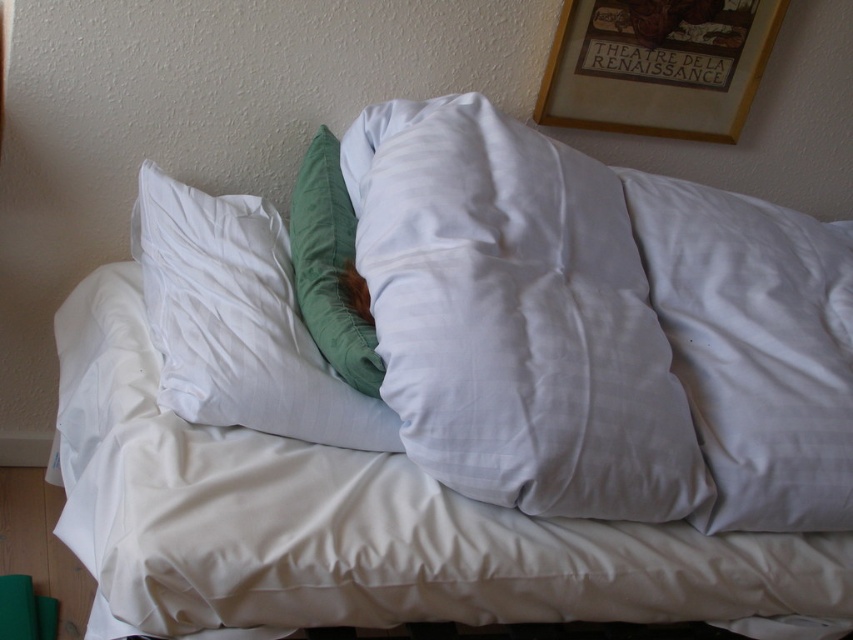
Is white smooth pillow at center to the left of white smooth pillow at right from the viewer's perspective?

Yes, white smooth pillow at center is to the left of white smooth pillow at right.

Does point (474, 323) come farther from viewer compared to point (698, 250)?

No, it is in front of (698, 250).

You are a GUI agent. You are given a task and a screenshot of the screen. Output one action in this format:
    pyautogui.click(x=<x>, y=<y>)
    Task: Click on the white smooth pillow at center
    Image resolution: width=853 pixels, height=640 pixels.
    Given the screenshot: What is the action you would take?
    pyautogui.click(x=515, y=316)

Does white smooth pillow at center appear under wooden picture frame at upper center?

Yes, white smooth pillow at center is below wooden picture frame at upper center.

The width and height of the screenshot is (853, 640). What do you see at coordinates (515, 316) in the screenshot?
I see `white smooth pillow at center` at bounding box center [515, 316].

At what (x,y) coordinates should I click in order to perform the action: click on white smooth pillow at center. Please return your answer as a coordinate pair (x, y). Looking at the image, I should click on (515, 316).

At what (x,y) coordinates should I click in order to perform the action: click on white smooth pillow at center. Please return your answer as a coordinate pair (x, y). Image resolution: width=853 pixels, height=640 pixels. Looking at the image, I should click on (515, 316).

Does white smooth pillow at right appear over wooden picture frame at upper center?

No.

Looking at this image, is white smooth pillow at right below wooden picture frame at upper center?

Correct, white smooth pillow at right is located below wooden picture frame at upper center.

Which is in front, point (677, 269) or point (756, 17)?

Point (677, 269) is in front.

Where is `white smooth pillow at right`? The width and height of the screenshot is (853, 640). white smooth pillow at right is located at coordinates (753, 348).